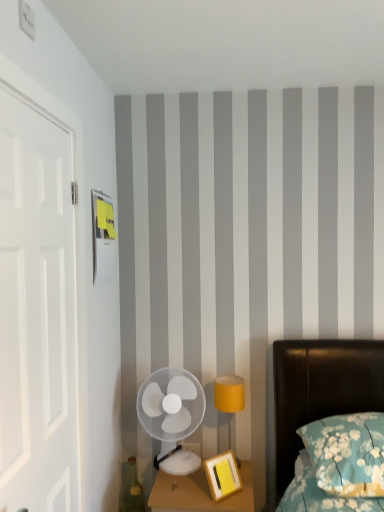
Question: Is the position of white matte door at left more distant than that of matte yellow lampshade at right?

Choices:
 (A) yes
 (B) no

Answer: (B)

Question: Is white matte door at left wider than matte yellow lampshade at right?

Choices:
 (A) no
 (B) yes

Answer: (A)

Question: From the image's perspective, does white matte door at left appear higher than matte yellow lampshade at right?

Choices:
 (A) no
 (B) yes

Answer: (B)

Question: Is matte yellow lampshade at right at the back of white matte door at left?

Choices:
 (A) no
 (B) yes

Answer: (A)

Question: Is white matte door at left positioned beyond the bounds of matte yellow lampshade at right?

Choices:
 (A) yes
 (B) no

Answer: (A)

Question: Is white matte door at left next to matte yellow lampshade at right and touching it?

Choices:
 (A) no
 (B) yes

Answer: (A)

Question: Can you confirm if teal glass bottle at lower left is bigger than white matte door at left?

Choices:
 (A) no
 (B) yes

Answer: (A)

Question: From the image's perspective, is teal glass bottle at lower left below white matte door at left?

Choices:
 (A) no
 (B) yes

Answer: (B)

Question: Is white matte door at left located within teal glass bottle at lower left?

Choices:
 (A) yes
 (B) no

Answer: (B)

Question: Considering the relative sizes of teal glass bottle at lower left and white matte door at left in the image provided, is teal glass bottle at lower left smaller than white matte door at left?

Choices:
 (A) yes
 (B) no

Answer: (A)

Question: Is teal glass bottle at lower left located outside white matte door at left?

Choices:
 (A) yes
 (B) no

Answer: (A)

Question: Does teal glass bottle at lower left turn towards white matte door at left?

Choices:
 (A) yes
 (B) no

Answer: (B)

Question: From the image's perspective, does matte yellow lampshade at right appear higher than teal floral pillow at lower right?

Choices:
 (A) yes
 (B) no

Answer: (B)